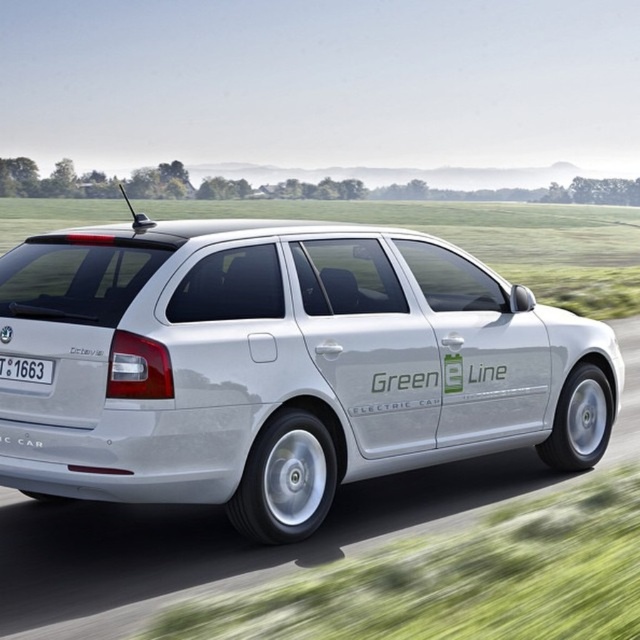
You are a delivery robot that is 1.5 meters tall. You are standing behind the white plastic license plate at rear and want to move forward to reach the white metallic car at center. Can you pass under it without hitting your head?

The distance between the white metallic car at center and the white plastic license plate at rear is 1.96 meters. Since the robot is 1.5 meters tall, there is enough clearance for it to pass under the car without hitting its head.

You are standing at the origin of the coordinate system in the image. You see two points, point [316,465] and point [12,362]. Which point is farther away from you?

Point [316,465] is behind point [12,362], so it is farther away from you.

You are a traffic officer observing a white metallic car at center and a white plastic license plate at rear. Which object is positioned lower in the image?

The white metallic car at center is located below the white plastic license plate at rear, so the car is positioned lower than the license plate.